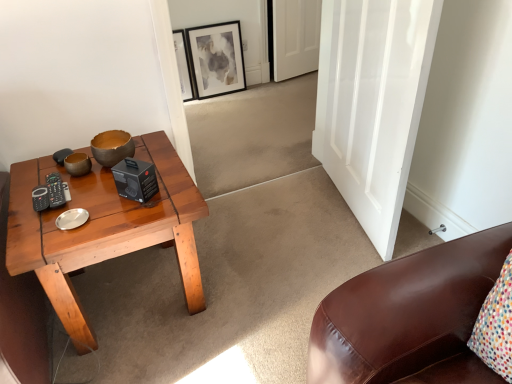
Question: Based on their sizes in the image, would you say white matte door at upper center, which is the 1th door in top-to-bottom order, is bigger or smaller than matte black picture frame at upper center?

Choices:
 (A) big
 (B) small

Answer: (A)

Question: From a real-world perspective, relative to matte black picture frame at upper center, is white matte door at upper center, which is counted as the 2th door, starting from the front, vertically above or below?

Choices:
 (A) above
 (B) below

Answer: (A)

Question: Which object is positioned closest to the matte brown bowl at center?

Choices:
 (A) white matte door at upper center, the 2th door when ordered from bottom to top
 (B) matte black picture frame at upper center
 (C) wooden coffee table at left
 (D) white glossy door at center, which is the 2th door from top to bottom

Answer: (C)

Question: Which is nearer to the matte brown bowl at center?

Choices:
 (A) white glossy door at center, marked as the first door in a bottom-to-top arrangement
 (B) matte black picture frame at upper center
 (C) wooden coffee table at left
 (D) white matte door at upper center, which is counted as the 2th door, starting from the front

Answer: (C)